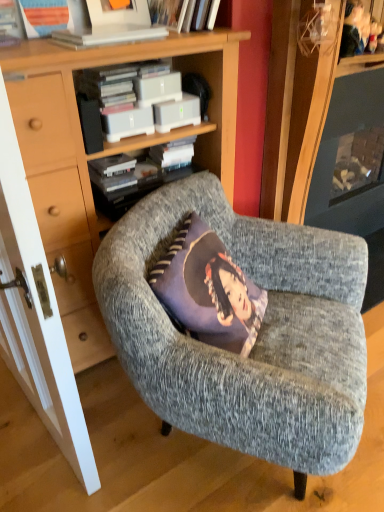
Where is `textured gray armchair at center`? textured gray armchair at center is located at coordinates (257, 337).

Between white matte book at upper center and white wood door at left, which one has less height?

white matte book at upper center is shorter.

Is white matte book at upper center next to white wood door at left?

No.

Is white matte book at upper center wider or thinner than white wood door at left?

Considering their sizes, white matte book at upper center looks broader than white wood door at left.

Can we say white matte book at upper center lies outside white wood door at left?

white matte book at upper center is positioned outside white wood door at left.

From a real-world perspective, who is located lower, wooden bookcase at center or white plastic book at upper center?

In real-world perspective, wooden bookcase at center is lower.

Locate an element on the screen. Image resolution: width=384 pixels, height=512 pixels. bookcase on the right of white plastic book at upper center is located at coordinates (82, 206).

Who is taller, wooden bookcase at center or white plastic book at upper center?

wooden bookcase at center.

Which is more distant, [264,264] or [21,196]?

Positioned behind is point [264,264].

From the image's perspective, is textured gray armchair at center above white wood door at left?

No.

Consider the image. Looking at the image, does textured gray armchair at center seem bigger or smaller compared to white wood door at left?

In the image, textured gray armchair at center appears to be larger than white wood door at left.

Is textured gray armchair at center with white wood door at left?

There is a gap between textured gray armchair at center and white wood door at left.

Is white plastic book at upper center smaller than white wood door at left?

Yes, white plastic book at upper center is smaller than white wood door at left.

From the image's perspective, is white plastic book at upper center under white wood door at left?

No, from the image's perspective, white plastic book at upper center is not below white wood door at left.

Does white plastic book at upper center touch white wood door at left?

white plastic book at upper center is not next to white wood door at left, and they're not touching.

Which is more to the left, white matte book at upper center or textured gray armchair at center?

white matte book at upper center.

How different are the orientations of white matte book at upper center and textured gray armchair at center in degrees?

They differ by 35.9 degrees in their facing directions.

Image resolution: width=384 pixels, height=512 pixels. Find the location of `chair in front of the white matte book at upper center`. chair in front of the white matte book at upper center is located at coordinates (257, 337).

Between white matte book at upper center and textured gray armchair at center, which one has more height?

With more height is textured gray armchair at center.

From the image's perspective, is white wood door at left over textured gray armchair at center?

Indeed, from the image's perspective, white wood door at left is shown above textured gray armchair at center.

Is point (42, 322) closer or farther from the camera than point (332, 237)?

Point (42, 322).

Does white wood door at left turn towards textured gray armchair at center?

No, white wood door at left is not turned towards textured gray armchair at center.

In the image, there is a white wood door at left. Where is `chair below it (from the image's perspective)`? The height and width of the screenshot is (512, 384). chair below it (from the image's perspective) is located at coordinates (257, 337).

Considering the sizes of objects white plastic book at upper center and wooden bookcase at center in the image provided, who is thinner, white plastic book at upper center or wooden bookcase at center?

With smaller width is white plastic book at upper center.

Does point (135, 35) lie in front of point (17, 68)?

That is False.

From the image's perspective, is white plastic book at upper center under wooden bookcase at center?

No, from the image's perspective, white plastic book at upper center is not beneath wooden bookcase at center.

From the picture: Is white plastic book at upper center aimed at wooden bookcase at center?

No, white plastic book at upper center is not oriented towards wooden bookcase at center.

Locate an element on the screen. This screenshot has width=384, height=512. door located underneath the white matte book at upper center (from a real-world perspective) is located at coordinates (36, 314).

Locate an element on the screen. This screenshot has width=384, height=512. book located on the left of wooden bookcase at center is located at coordinates (108, 35).

Based on their spatial positions, is textured gray armchair at center or wooden bookcase at center further from white wood door at left?

Based on the image, textured gray armchair at center appears to be further to white wood door at left.

When comparing their distances from wooden bookcase at center, does white wood door at left or white plastic book at upper center seem further?

white plastic book at upper center is further to wooden bookcase at center.

From the image, which object appears to be farther from white matte book at upper center, white wood door at left or textured gray armchair at center?

Based on the image, white wood door at left appears to be further to white matte book at upper center.

Based on their spatial positions, is textured gray armchair at center or white wood door at left further from white matte book at upper center?

The object further to white matte book at upper center is white wood door at left.

Looking at the image, which one is located closer to white plastic book at upper center, white wood door at left or wooden bookcase at center?

Based on the image, wooden bookcase at center appears to be nearer to white plastic book at upper center.

In the scene shown: When comparing their distances from wooden bookcase at center, does textured gray armchair at center or white wood door at left seem closer?

white wood door at left is closer to wooden bookcase at center.

Which object lies nearer to the anchor point wooden bookcase at center, white wood door at left or white matte book at upper center?

Based on the image, white wood door at left appears to be nearer to wooden bookcase at center.

Looking at the image, which one is located further to white wood door at left, white plastic book at upper center or wooden bookcase at center?

white plastic book at upper center is positioned further to the anchor white wood door at left.

You are a GUI agent. You are given a task and a screenshot of the screen. Output one action in this format:
    pyautogui.click(x=<x>, y=<y>)
    Task: Click on the bookcase positioned between textured gray armchair at center and white matte book at upper center from near to far
    The image size is (384, 512).
    Given the screenshot: What is the action you would take?
    pyautogui.click(x=82, y=206)

Find the location of a particular element. This screenshot has height=512, width=384. bookcase that lies between white plastic book at upper center and textured gray armchair at center from top to bottom is located at coordinates (82, 206).

Where is `book positioned between white wood door at left and white matte book at upper center from near to far`? This screenshot has width=384, height=512. book positioned between white wood door at left and white matte book at upper center from near to far is located at coordinates (108, 35).

The image size is (384, 512). I want to click on bookcase between white plastic book at upper center and white wood door at left in the up-down direction, so click(82, 206).